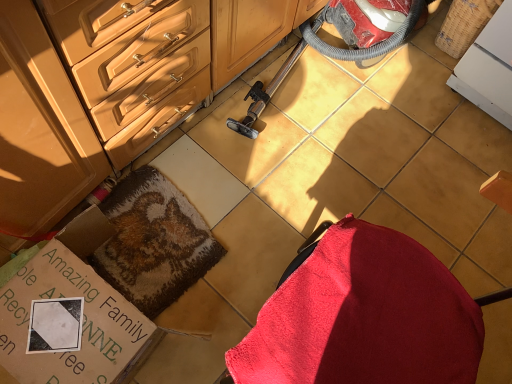
Identify the location of vacant region to the right of red plastic vacuum cleaner at center. The width and height of the screenshot is (512, 384). (435, 132).